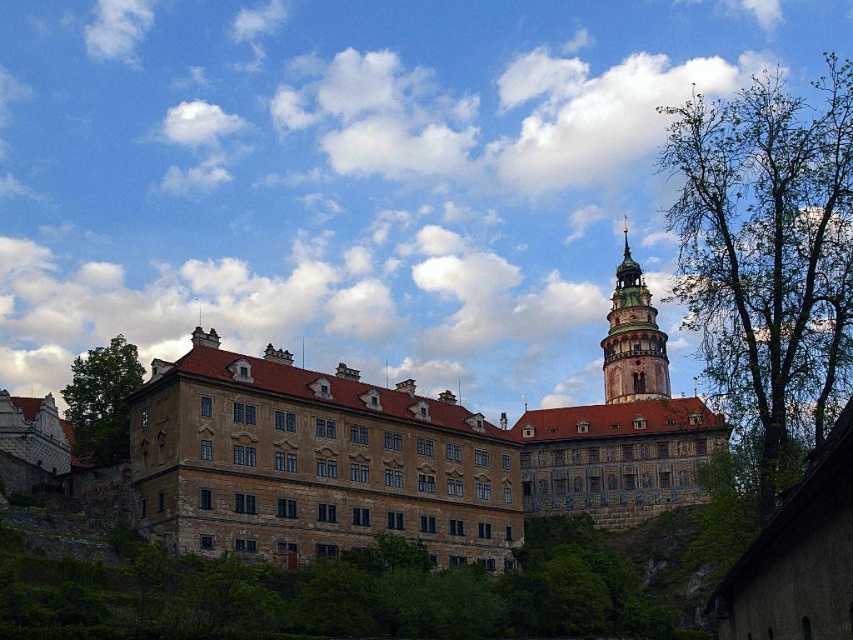
You are standing in front of the grand historical building and want to take a photo that includes both the green leafy tree at right and the green leafy tree at left. Which tree should you move closer to in order to capture both trees in the frame?

You should move closer to the green leafy tree at left because it is farther away from the viewer compared to the tree at right, allowing both to fit within the frame.

You are standing in front of the grand historical building and notice the green leafy tree at left and the green wooden tower at upper center. Which object is taller when viewed from your current position?

The green wooden tower at upper center is taller than the green leafy tree at left.